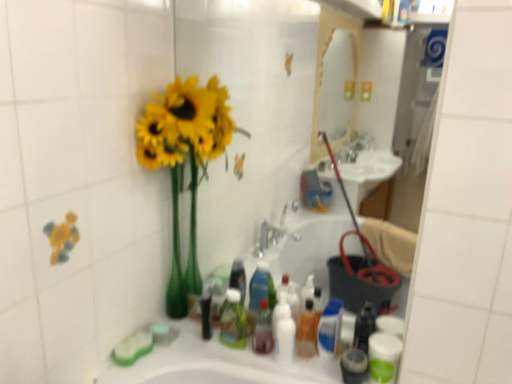
Question: Can you confirm if yellow matte vase at left is thinner than white glossy bottle at center, the 2th toiletry from the left?

Choices:
 (A) yes
 (B) no

Answer: (B)

Question: Does yellow matte vase at left have a lesser height compared to white glossy bottle at center, arranged as the 2th toiletry when viewed from the right?

Choices:
 (A) yes
 (B) no

Answer: (B)

Question: From the image's perspective, is yellow matte vase at left on top of white glossy bottle at center, the 2th toiletry from the left?

Choices:
 (A) no
 (B) yes

Answer: (B)

Question: Is white glossy bottle at center, arranged as the 2th toiletry when viewed from the right, a part of yellow matte vase at left?

Choices:
 (A) yes
 (B) no

Answer: (B)

Question: Can you confirm if yellow matte vase at left is positioned to the right of white glossy bottle at center, the 2th toiletry from the left?

Choices:
 (A) no
 (B) yes

Answer: (A)

Question: From the image's perspective, is translucent plastic mouthwash at center, which is the second mouthwash in left-to-right order, located above or below yellow matte vase at left?

Choices:
 (A) below
 (B) above

Answer: (A)

Question: Is translucent plastic mouthwash at center, which is the second mouthwash in left-to-right order, inside the boundaries of yellow matte vase at left, or outside?

Choices:
 (A) inside
 (B) outside

Answer: (B)

Question: Looking at their shapes, would you say translucent plastic mouthwash at center, which is the second mouthwash in left-to-right order, is wider or thinner than yellow matte vase at left?

Choices:
 (A) wide
 (B) thin

Answer: (B)

Question: From their relative heights in the image, would you say translucent plastic mouthwash at center, which is the second mouthwash in left-to-right order, is taller or shorter than yellow matte vase at left?

Choices:
 (A) tall
 (B) short

Answer: (B)

Question: Is point (259, 326) positioned closer to the camera than point (227, 294)?

Choices:
 (A) closer
 (B) farther

Answer: (A)

Question: Would you say translucent plastic mouthwash at center, placed as the 4th mouthwash when sorted from right to left, is inside or outside translucent plastic bottle at center, which is counted as the 3th toiletry, starting from the right?

Choices:
 (A) outside
 (B) inside

Answer: (A)

Question: From their relative heights in the image, would you say translucent plastic mouthwash at center, placed as the 4th mouthwash when sorted from right to left, is taller or shorter than translucent plastic bottle at center, arranged as the first toiletry when viewed from the left?

Choices:
 (A) short
 (B) tall

Answer: (A)

Question: Based on their sizes in the image, would you say translucent plastic mouthwash at center, which ranks as the 1th mouthwash in left-to-right order, is bigger or smaller than translucent plastic bottle at center, which is counted as the 3th toiletry, starting from the right?

Choices:
 (A) big
 (B) small

Answer: (B)

Question: Is translucent plastic mouthwash at center, placed as the third mouthwash when sorted from right to left, bigger or smaller than translucent plastic soap dispenser at center, the first toiletry from the right?

Choices:
 (A) small
 (B) big

Answer: (A)

Question: From the image's perspective, is translucent plastic mouthwash at center, placed as the third mouthwash when sorted from right to left, located above or below translucent plastic soap dispenser at center, the third toiletry in the left-to-right sequence?

Choices:
 (A) above
 (B) below

Answer: (B)